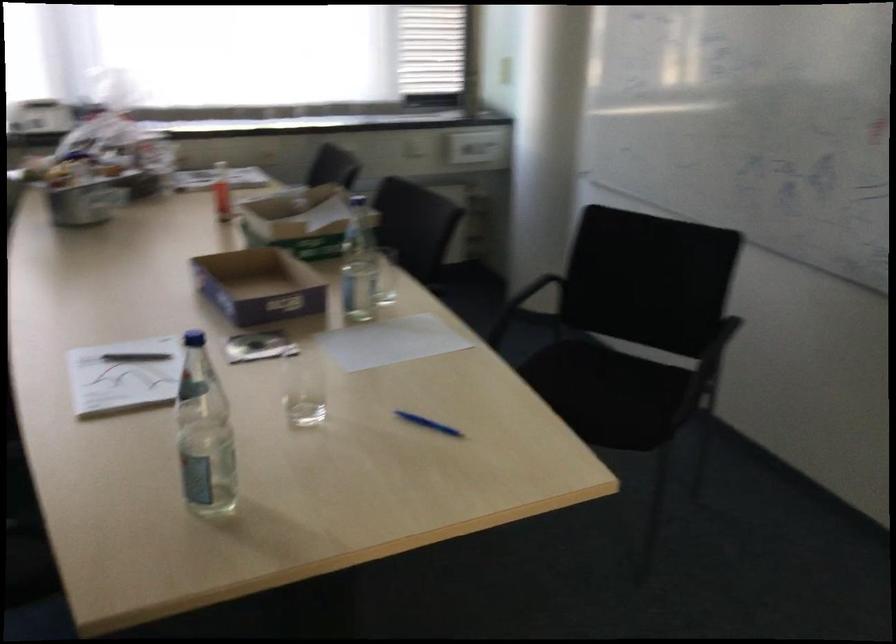
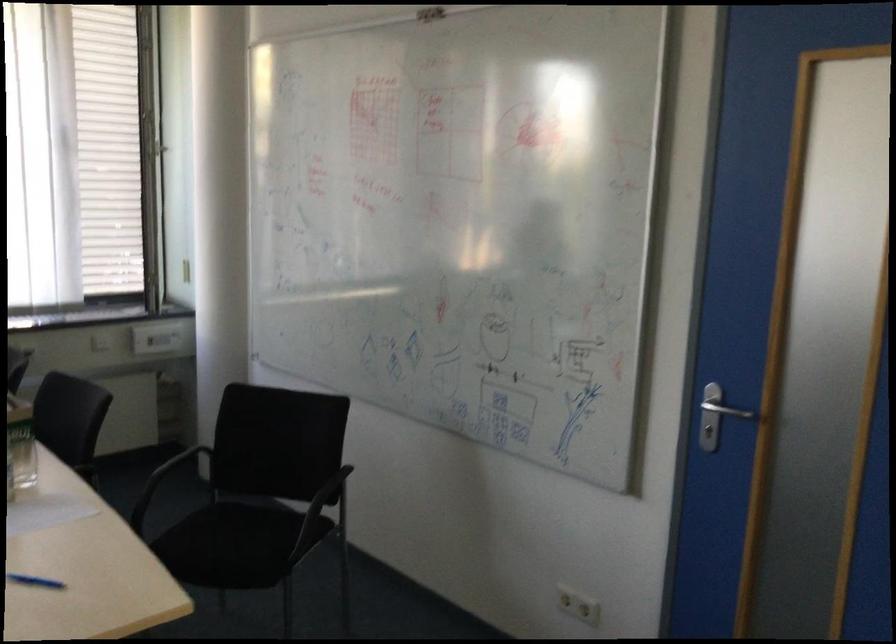
In the second image, find the point that corresponds to [609,377] in the first image.

(251, 529)